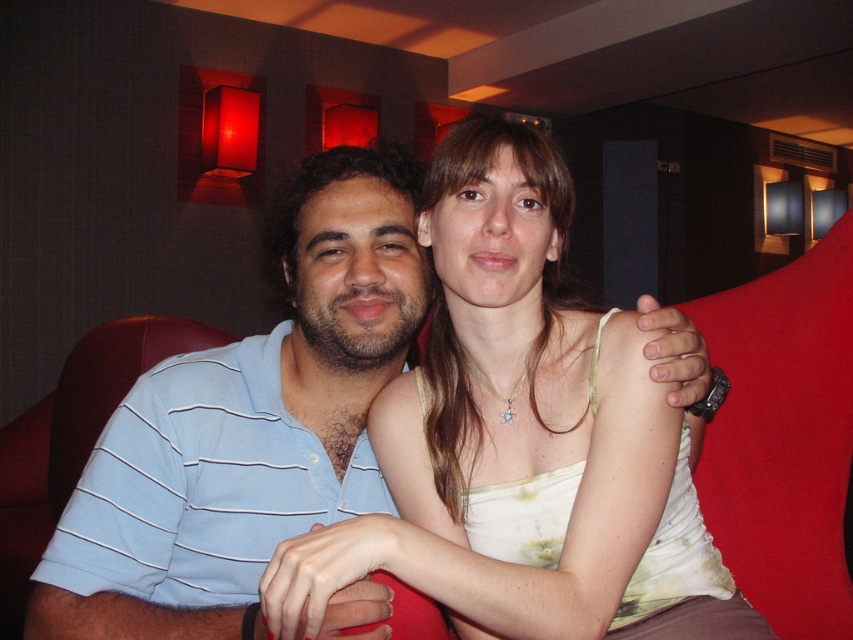
Question: Can you confirm if white cotton tank top at center is thinner than blue striped polo shirt at left?

Choices:
 (A) no
 (B) yes

Answer: (A)

Question: Which point appears farthest from the camera in this image?

Choices:
 (A) [x=242, y=621]
 (B) [x=316, y=541]

Answer: (A)

Question: Is white cotton tank top at center closer to camera compared to blue striped polo shirt at left?

Choices:
 (A) yes
 (B) no

Answer: (A)

Question: Can you confirm if white cotton tank top at center is positioned to the left of blue striped polo shirt at left?

Choices:
 (A) no
 (B) yes

Answer: (A)

Question: Among these points, which one is farthest from the camera?

Choices:
 (A) [x=440, y=195]
 (B) [x=218, y=416]

Answer: (B)

Question: Which of the following is the closest to the observer?

Choices:
 (A) white cotton tank top at center
 (B) blue striped polo shirt at left

Answer: (A)